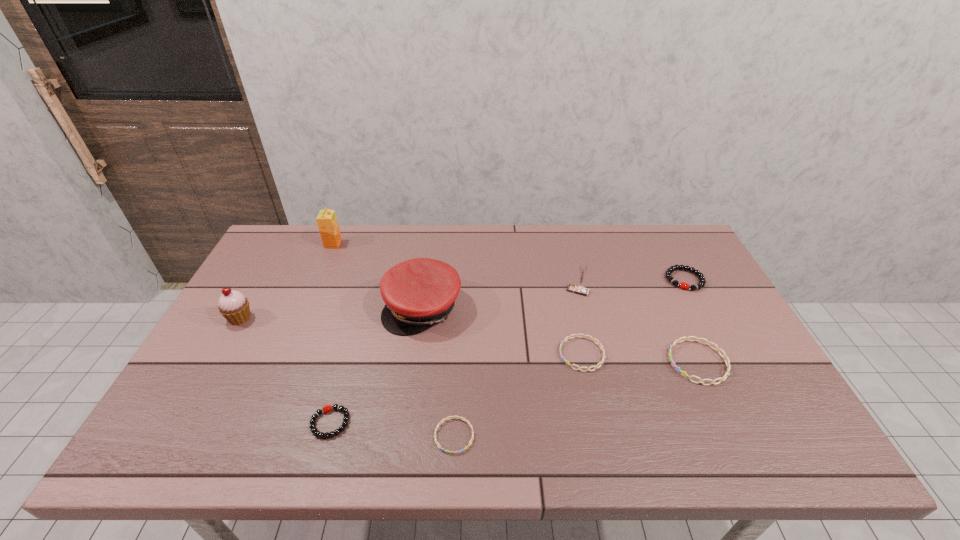
At what (x,y) coordinates should I click in order to perform the action: click on free space between the cupcake and the tallest object. Please return your answer as a coordinate pair (x, y). This screenshot has width=960, height=540. Looking at the image, I should click on (287, 281).

You are a GUI agent. You are given a task and a screenshot of the screen. Output one action in this format:
    pyautogui.click(x=<x>, y=<y>)
    Task: Click on the free spot between the right black bracelet and the cupcake
    
    Given the screenshot: What is the action you would take?
    pyautogui.click(x=462, y=299)

Find the location of `vacant area between the leftmost object and the shortest object`. vacant area between the leftmost object and the shortest object is located at coordinates (348, 377).

This screenshot has width=960, height=540. Identify the location of object that is the fifth closest to the farthest object. tap(583, 267).

Identify which object is the fifth closest to the rightmost blue bracelet. Please provide its 2D coordinates. Your answer should be formatted as a tuple, i.e. [(x, y)], where the tuple contains the x and y coordinates of a point satisfying the conditions above.

[(421, 292)]

Where is `bracelet object that ranks as the second closest to the orange juice`? The width and height of the screenshot is (960, 540). bracelet object that ranks as the second closest to the orange juice is located at coordinates (451, 452).

Identify the location of bracelet that stands as the second closest to the left black bracelet. (568, 337).

You are a GUI agent. You are given a task and a screenshot of the screen. Output one action in this format:
    pyautogui.click(x=<x>, y=<y>)
    Task: Click on the blue bracelet that is the second closest to the second smallest blue bracelet
    The height and width of the screenshot is (540, 960).
    Given the screenshot: What is the action you would take?
    pyautogui.click(x=451, y=452)

Locate which blue bracelet is the closest to the shortest object. Please provide its 2D coordinates. Your answer should be formatted as a tuple, i.e. [(x, y)], where the tuple contains the x and y coordinates of a point satisfying the conditions above.

[(568, 337)]

The width and height of the screenshot is (960, 540). I want to click on vacant space that satisfies the following two spatial constraints: 1. on the back side of the matchbox; 2. on the right side of the bigger black bracelet, so point(575,280).